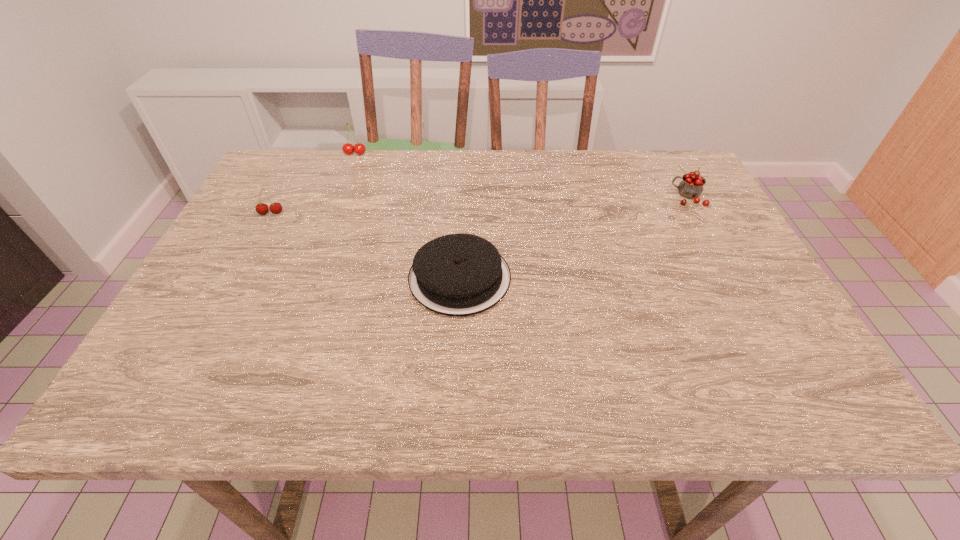
Find the location of a particular element. Image resolution: width=960 pixels, height=540 pixels. free space between the nearest cherry and the rightmost object is located at coordinates (479, 205).

I want to click on object identified as the second closest to the third farthest object, so click(x=458, y=275).

Image resolution: width=960 pixels, height=540 pixels. I want to click on object identified as the third closest to the pancake, so click(691, 186).

Point out which cherry is positioned as the second nearest to the farthest object. Please provide its 2D coordinates. Your answer should be formatted as a tuple, i.e. [(x, y)], where the tuple contains the x and y coordinates of a point satisfying the conditions above.

[(691, 186)]

Locate which cherry ranks in proximity to the nearest cherry. Please provide its 2D coordinates. Your answer should be formatted as a tuple, i.e. [(x, y)], where the tuple contains the x and y coordinates of a point satisfying the conditions above.

[(359, 148)]

You are a GUI agent. You are given a task and a screenshot of the screen. Output one action in this format:
    pyautogui.click(x=<x>, y=<y>)
    Task: Click on the vacant space that satisfies the following two spatial constraints: 1. on the surface of the nearest cherry; 2. on the left side of the shortest object
    The height and width of the screenshot is (540, 960).
    Given the screenshot: What is the action you would take?
    pyautogui.click(x=237, y=278)

At what (x,y) coordinates should I click in order to perform the action: click on vacant space that satisfies the following two spatial constraints: 1. with the stems of the shortest object pointing upwards; 2. on the left side of the farthest object. Please return your answer as a coordinate pair (x, y). This screenshot has height=540, width=960. Looking at the image, I should click on (308, 278).

Identify the location of vacant space that satisfies the following two spatial constraints: 1. on the surface of the pancake; 2. on the right side of the nearest cherry. (237, 278).

Identify the location of vacant space that satisfies the following two spatial constraints: 1. on the surface of the shortest object; 2. on the right side of the nearest cherry. (237, 278).

Image resolution: width=960 pixels, height=540 pixels. What are the coordinates of `vacant space that satisfies the following two spatial constraints: 1. on the surface of the leftmost cherry; 2. on the left side of the nearest object` in the screenshot? It's located at (237, 278).